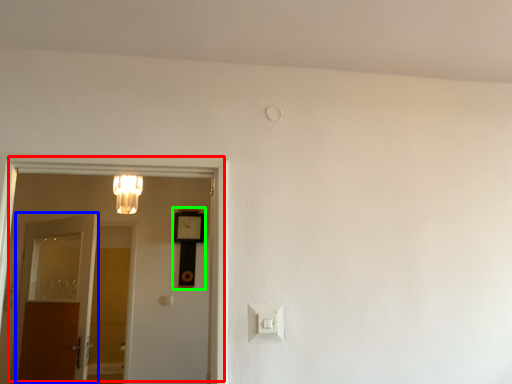
Question: Based on their relative distances, which object is nearer to door (highlighted by a red box)? Choose from door (highlighted by a blue box) and clock (highlighted by a green box).

Choices:
 (A) door
 (B) clock

Answer: (A)